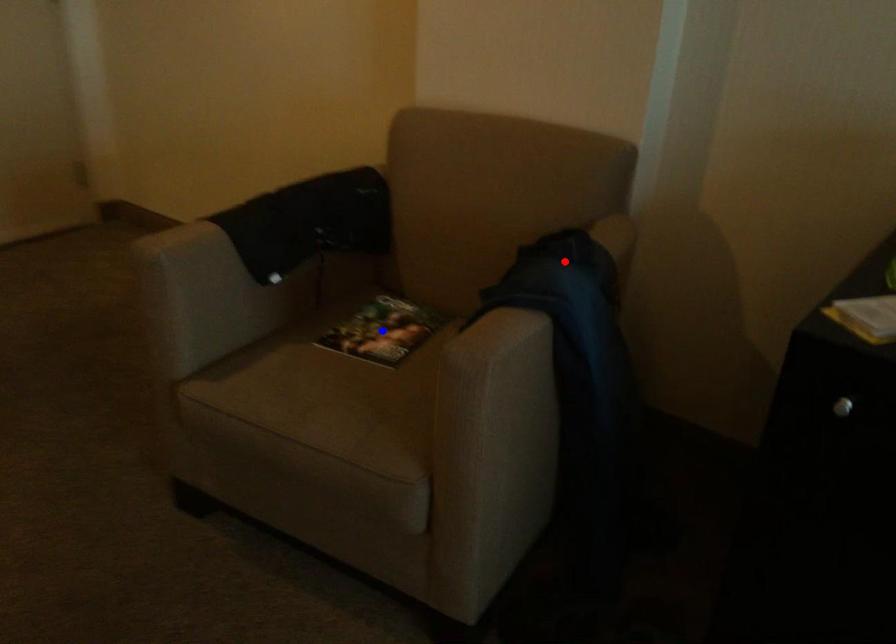
Question: In the image, two points are highlighted. Which point is nearer to the camera? Reply with the corresponding letter.

Choices:
 (A) blue point
 (B) red point

Answer: (B)